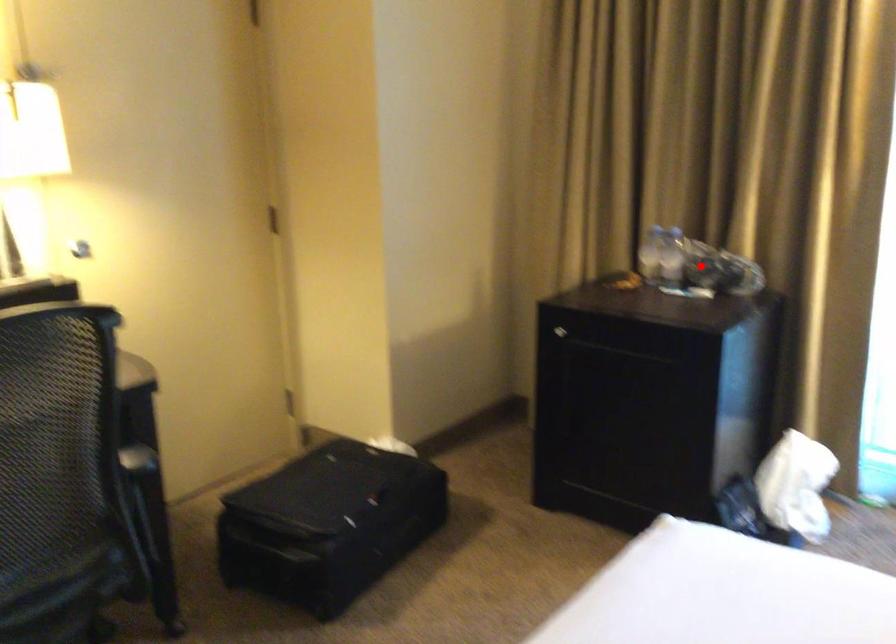
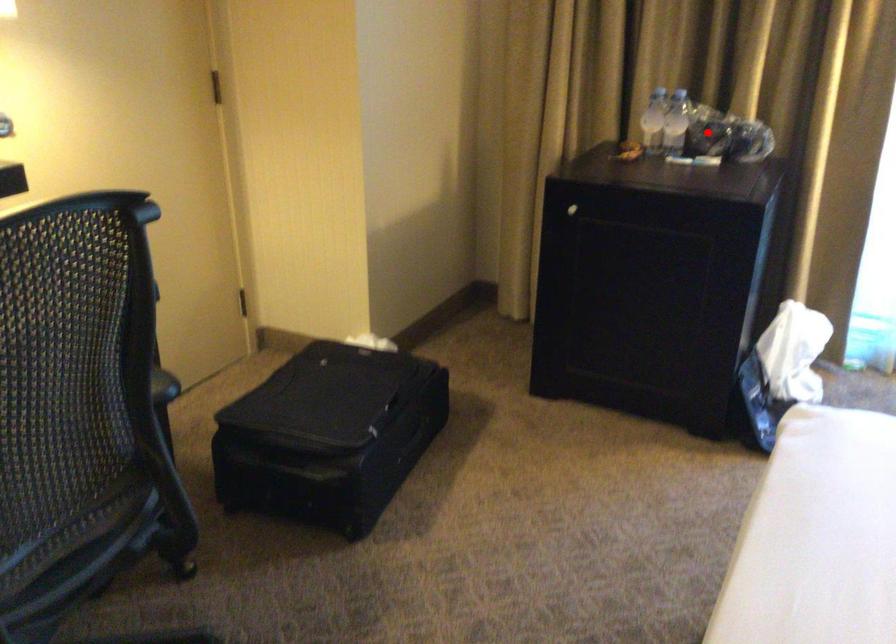
I am providing you with two images of the same scene from different viewpoints. A red point is marked on the first image and another point is marked on the second image. Are the points marked in image1 and image2 representing the same 3D position?

Yes